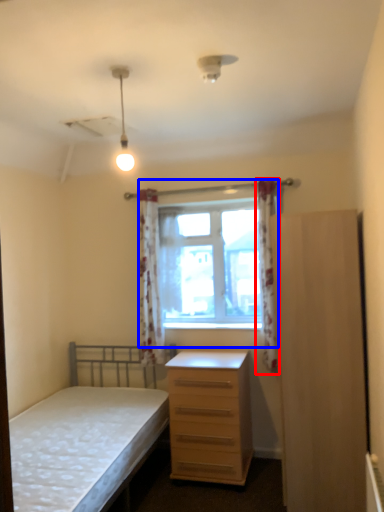
Question: Among these objects, which one is farthest to the camera, curtain (highlighted by a red box) or window (highlighted by a blue box)?

Choices:
 (A) curtain
 (B) window

Answer: (B)